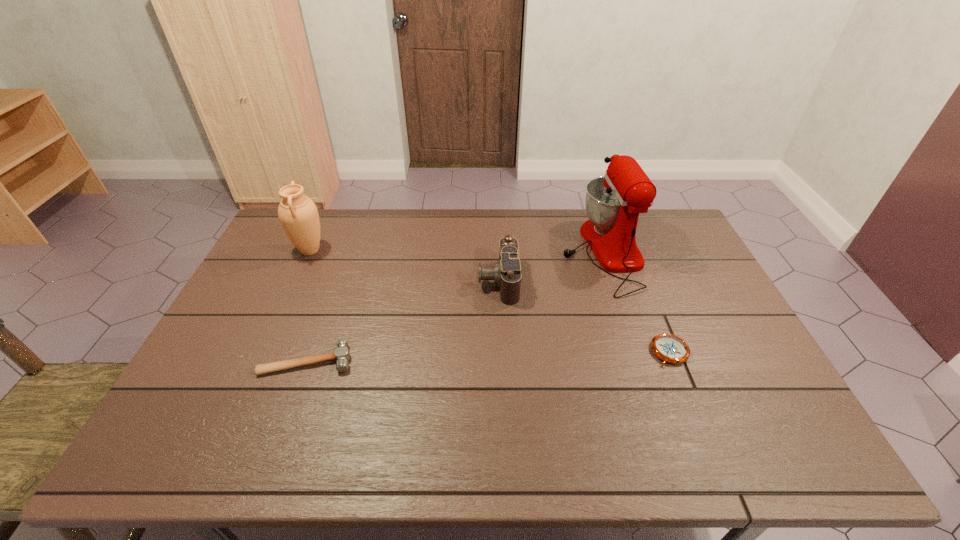
In the image, there is a desktop. Where is `vacant space at the far edge`? The height and width of the screenshot is (540, 960). vacant space at the far edge is located at coordinates (391, 239).

This screenshot has width=960, height=540. Find the location of `blank space at the near edge`. blank space at the near edge is located at coordinates (448, 455).

Where is `vacant space at the left edge of the desktop`? vacant space at the left edge of the desktop is located at coordinates (223, 400).

Where is `free region at the right edge of the desktop`? free region at the right edge of the desktop is located at coordinates coord(683,312).

Identify the location of blank space at the far right corner. The height and width of the screenshot is (540, 960). (647, 242).

Find the location of a particular element. The image size is (960, 540). free region at the near right corner is located at coordinates (793, 443).

Where is `unoccupied position between the second tallest object and the mixer`? unoccupied position between the second tallest object and the mixer is located at coordinates (456, 252).

Locate an element on the screen. Image resolution: width=960 pixels, height=540 pixels. empty space that is in between the camera and the mixer is located at coordinates (550, 267).

I want to click on free area in between the camera and the second shortest object, so click(x=403, y=321).

At what (x,y) coordinates should I click in order to perform the action: click on vacant area that lies between the fourth shortest object and the compass. Please return your answer as a coordinate pair (x, y). Image resolution: width=960 pixels, height=540 pixels. Looking at the image, I should click on pos(490,301).